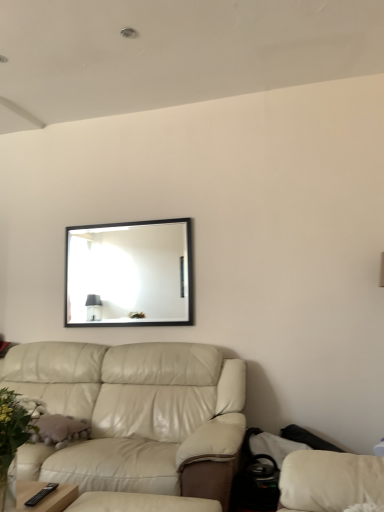
Describe the element at coordinates (129, 274) in the screenshot. The image size is (384, 512). I see `black framed mirror at upper center` at that location.

Measure the distance between green leafy plant at lower left and camera.

They are 1.72 meters apart.

Locate an element on the screen. This screenshot has width=384, height=512. black framed mirror at upper center is located at coordinates (129, 274).

Is green leafy plant at lower left positioned in front of black framed mirror at upper center?

Yes, green leafy plant at lower left is closer to the camera.

Considering the sizes of objects green leafy plant at lower left and black framed mirror at upper center in the image provided, who is bigger, green leafy plant at lower left or black framed mirror at upper center?

With larger size is green leafy plant at lower left.

Is green leafy plant at lower left oriented towards black framed mirror at upper center?

No, green leafy plant at lower left is not aimed at black framed mirror at upper center.

Between point (17, 402) and point (107, 319), which one is positioned behind?

The point (107, 319) is farther.

Locate an element on the screen. mirror that appears on the right of leather couch at lower left is located at coordinates pos(129,274).

Is leather couch at lower left aimed at black framed mirror at upper center?

No, leather couch at lower left is not oriented towards black framed mirror at upper center.

Between leather couch at lower left and black framed mirror at upper center, which one appears on the right side from the viewer's perspective?

Positioned to the right is black framed mirror at upper center.

How far apart are leather couch at lower left and black framed mirror at upper center?

28.43 inches.

Can green leafy plant at lower left be found inside leather couch at lower left?

No, green leafy plant at lower left is not inside leather couch at lower left.

Is leather couch at lower left in front of green leafy plant at lower left?

No.

Is there a large distance between leather couch at lower left and green leafy plant at lower left?

No.

From a real-world perspective, is leather couch at lower left physically located above or below green leafy plant at lower left?

From a real-world perspective, leather couch at lower left is physically below green leafy plant at lower left.

From a real-world perspective, is black framed mirror at upper center physically located above or below leather couch at lower left?

From a real-world perspective, black framed mirror at upper center is physically above leather couch at lower left.

Is black framed mirror at upper center far from leather couch at lower left?

Actually, black framed mirror at upper center and leather couch at lower left are a little close together.

From the image's perspective, is black framed mirror at upper center located beneath leather couch at lower left?

No, from the image's perspective, black framed mirror at upper center is not beneath leather couch at lower left.

I want to click on floral arrangement on the left of the black framed mirror at upper center, so click(11, 435).

Is black framed mirror at upper center closer to camera compared to green leafy plant at lower left?

No, black framed mirror at upper center is behind green leafy plant at lower left.

From the image's perspective, is black framed mirror at upper center under green leafy plant at lower left?

Actually, black framed mirror at upper center appears above green leafy plant at lower left in the image.

Is black framed mirror at upper center looking in the opposite direction of green leafy plant at lower left?

That's not correct — black framed mirror at upper center is not looking away from green leafy plant at lower left.

Which is closer, [10,494] or [51,383]?

Point [10,494] is closer to the camera than point [51,383].

Is green leafy plant at lower left outside of leather couch at lower left?

Indeed, green leafy plant at lower left is completely outside leather couch at lower left.

Where is `studio couch behind the green leafy plant at lower left`? The width and height of the screenshot is (384, 512). studio couch behind the green leafy plant at lower left is located at coordinates (136, 416).

Is green leafy plant at lower left oriented away from leather couch at lower left?

Yes.

In the image, there is a black framed mirror at upper center. Identify the location of floral arrangement below it (from a real-world perspective). (11, 435).

The height and width of the screenshot is (512, 384). What are the coordinates of `mirror located above the leather couch at lower left (from a real-world perspective)` in the screenshot? It's located at (129, 274).

From the image, which object appears to be nearer to black framed mirror at upper center, green leafy plant at lower left or leather couch at lower left?

The object closer to black framed mirror at upper center is leather couch at lower left.

When comparing their distances from green leafy plant at lower left, does black framed mirror at upper center or leather couch at lower left seem further?

black framed mirror at upper center is further to green leafy plant at lower left.

Estimate the real-world distances between objects in this image. Which object is closer to leather couch at lower left, green leafy plant at lower left or black framed mirror at upper center?

green leafy plant at lower left is closer to leather couch at lower left.

Based on their spatial positions, is black framed mirror at upper center or green leafy plant at lower left further from leather couch at lower left?

black framed mirror at upper center is further to leather couch at lower left.

Looking at the image, which one is located further to green leafy plant at lower left, leather couch at lower left or black framed mirror at upper center?

The object further to green leafy plant at lower left is black framed mirror at upper center.

Which object lies further to the anchor point black framed mirror at upper center, leather couch at lower left or green leafy plant at lower left?

green leafy plant at lower left is further to black framed mirror at upper center.

This screenshot has height=512, width=384. I want to click on studio couch between green leafy plant at lower left and black framed mirror at upper center in the front-back direction, so tap(136, 416).